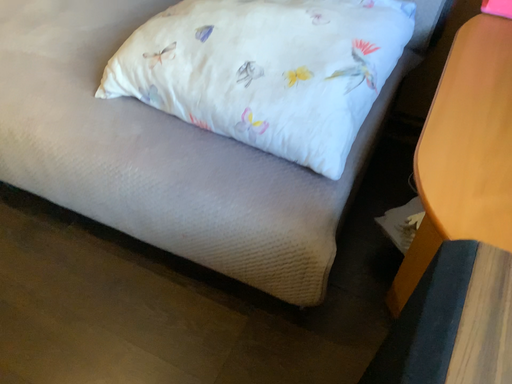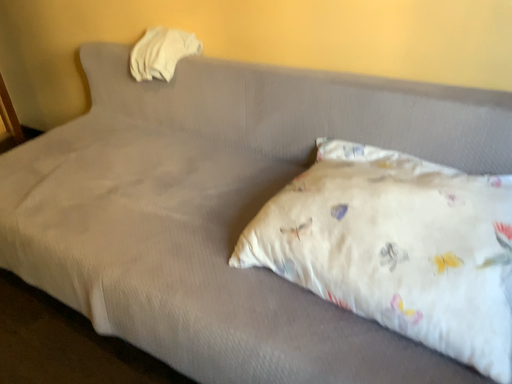
Question: How did the camera likely rotate when shooting the video?

Choices:
 (A) rotated left
 (B) rotated right

Answer: (A)